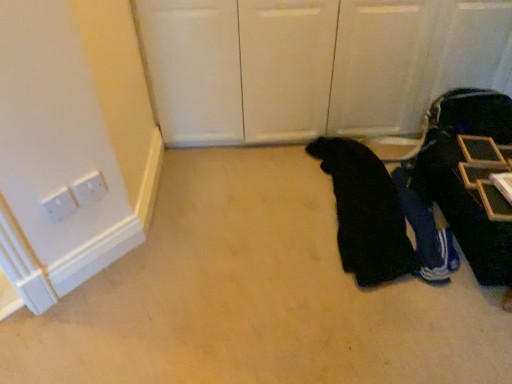
Question: Is blue fabric pants at lower right, acting as the first person starting from the right, touching dark blue fabric suitcase at right?

Choices:
 (A) no
 (B) yes

Answer: (A)

Question: Would you say blue fabric pants at lower right, marked as the 2th person in a left-to-right arrangement, contains dark blue fabric suitcase at right?

Choices:
 (A) yes
 (B) no

Answer: (B)

Question: Is blue fabric pants at lower right, marked as the 2th person in a left-to-right arrangement, closer to camera compared to dark blue fabric suitcase at right?

Choices:
 (A) yes
 (B) no

Answer: (B)

Question: Is blue fabric pants at lower right, acting as the first person starting from the right, outside of dark blue fabric suitcase at right?

Choices:
 (A) yes
 (B) no

Answer: (B)

Question: Is blue fabric pants at lower right, acting as the first person starting from the right, to the right of dark blue fabric suitcase at right from the viewer's perspective?

Choices:
 (A) no
 (B) yes

Answer: (A)

Question: In terms of height, does blue fabric pants at lower right, acting as the first person starting from the right, look taller or shorter compared to black fabric at lower right, positioned as the second person in right-to-left order?

Choices:
 (A) short
 (B) tall

Answer: (A)

Question: In terms of size, does blue fabric pants at lower right, marked as the 2th person in a left-to-right arrangement, appear bigger or smaller than black fabric at lower right, acting as the first person starting from the left?

Choices:
 (A) big
 (B) small

Answer: (B)

Question: From a real-world perspective, relative to black fabric at lower right, acting as the first person starting from the left, is blue fabric pants at lower right, marked as the 2th person in a left-to-right arrangement, vertically above or below?

Choices:
 (A) below
 (B) above

Answer: (A)

Question: Considering their positions, is blue fabric pants at lower right, acting as the first person starting from the right, located in front of or behind black fabric at lower right, positioned as the second person in right-to-left order?

Choices:
 (A) front
 (B) behind

Answer: (B)

Question: Is point (439, 208) closer or farther from the camera than point (450, 254)?

Choices:
 (A) farther
 (B) closer

Answer: (A)

Question: Relative to blue fabric pants at lower right, marked as the 2th person in a left-to-right arrangement, is dark blue fabric suitcase at right in front or behind?

Choices:
 (A) front
 (B) behind

Answer: (A)

Question: In terms of size, does dark blue fabric suitcase at right appear bigger or smaller than blue fabric pants at lower right, marked as the 2th person in a left-to-right arrangement?

Choices:
 (A) big
 (B) small

Answer: (A)

Question: From the image's perspective, is dark blue fabric suitcase at right above or below blue fabric pants at lower right, acting as the first person starting from the right?

Choices:
 (A) below
 (B) above

Answer: (B)

Question: From a real-world perspective, is dark blue fabric suitcase at right above or below black fabric at lower right, acting as the first person starting from the left?

Choices:
 (A) below
 (B) above

Answer: (B)

Question: Would you say dark blue fabric suitcase at right is to the left or to the right of black fabric at lower right, acting as the first person starting from the left, in the picture?

Choices:
 (A) left
 (B) right

Answer: (B)